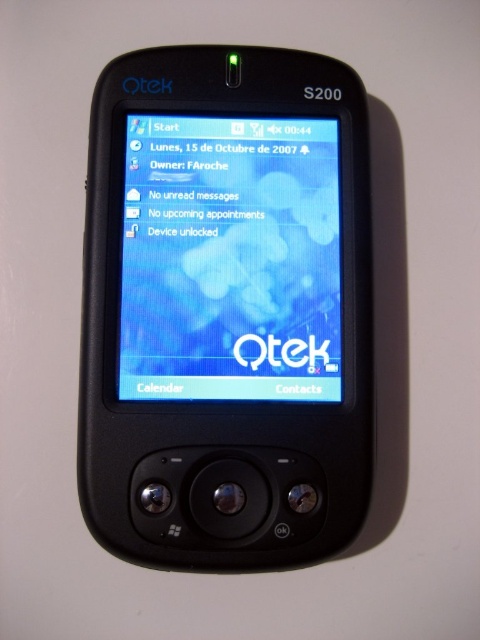
You are holding a Qtek S200 mobile device. You want to place both the black matte smartphone at center and the matte plastic screen at center into a protective case that can only accommodate items up to the size of the smartphone. Which item will not fit inside the case?

The matte plastic screen at center will not fit inside the case because the black matte smartphone at center is bigger than the matte plastic screen at center, so the case designed for the smartphone may be too small for the screen.

You are a technician who needs to place a protective sticker on the exact center of the black matte smartphone at center. According to the coordinates provided, where should you place the sticker?

The sticker should be placed at the coordinates point (227,308), which is the exact center of the black matte smartphone at center as specified in the description.

You are holding the black matte smartphone at center and want to see the matte plastic screen at center clearly. Since the smartphone is blocking part of the screen, how can you adjust your view?

The black matte smartphone at center is in front of the matte plastic screen at center, so you can move the smartphone to the side to allow a clear view of the matte plastic screen at center.